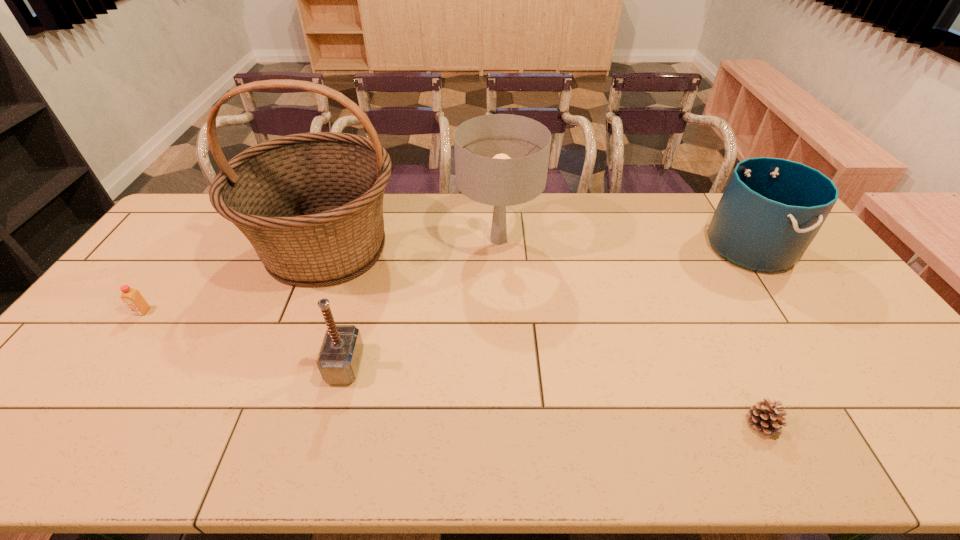
Image resolution: width=960 pixels, height=540 pixels. What are the coordinates of `object that is at the right edge` in the screenshot? It's located at click(771, 210).

The image size is (960, 540). In order to click on object that is at the far right corner in this screenshot , I will do `click(771, 210)`.

In the image, there is a desktop. In order to click on free region at the far edge in this screenshot , I will do `click(659, 222)`.

Find the location of a particular element. The image size is (960, 540). vacant space at the near left corner of the desktop is located at coordinates (55, 449).

The image size is (960, 540). What are the coordinates of `vacant space that's between the hammer and the leftmost object` in the screenshot? It's located at (244, 338).

Locate an element on the screen. Image resolution: width=960 pixels, height=540 pixels. vacant region between the tallest object and the fourth object from left to right is located at coordinates (413, 244).

Locate an element on the screen. Image resolution: width=960 pixels, height=540 pixels. vacant space in between the bucket and the nearest object is located at coordinates (756, 335).

The image size is (960, 540). Identify the location of free space that is in between the hammer and the basket. (336, 306).

The width and height of the screenshot is (960, 540). In order to click on free space that is in between the shortest object and the third nearest object in this screenshot , I will do `click(452, 368)`.

Image resolution: width=960 pixels, height=540 pixels. Find the location of `free area in between the rightmost object and the pinecone`. free area in between the rightmost object and the pinecone is located at coordinates (756, 335).